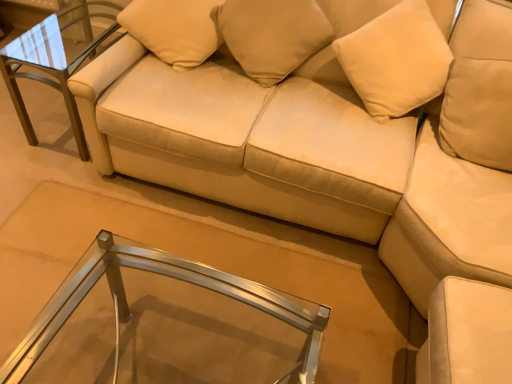
Question: From a real-world perspective, is beige fabric pillow at upper center, the 2th pillow viewed from the left, beneath clear glass table at center, positioned as the second table in top-to-bottom order?

Choices:
 (A) no
 (B) yes

Answer: (A)

Question: From the image's perspective, does beige fabric pillow at upper center, the first pillow positioned from the right, appear higher than clear glass table at center, the first table in the right-to-left sequence?

Choices:
 (A) no
 (B) yes

Answer: (B)

Question: Is beige fabric pillow at upper center, the 2th pillow viewed from the left, shorter than clear glass table at center, the first table in the right-to-left sequence?

Choices:
 (A) yes
 (B) no

Answer: (B)

Question: Is beige fabric pillow at upper center, the 2th pillow viewed from the left, looking in the opposite direction of clear glass table at center, the 1th table in the front-to-back sequence?

Choices:
 (A) no
 (B) yes

Answer: (A)

Question: Considering the relative sizes of beige fabric pillow at upper center, the 2th pillow viewed from the left, and clear glass table at center, the 2th table positioned from the left, in the image provided, is beige fabric pillow at upper center, the 2th pillow viewed from the left, smaller than clear glass table at center, the 2th table positioned from the left,?

Choices:
 (A) yes
 (B) no

Answer: (A)

Question: From a real-world perspective, relative to beige fabric pillow at upper center, which appears as the first pillow when viewed from the left, is clear glass table at center, the 2th table positioned from the left, vertically above or below?

Choices:
 (A) above
 (B) below

Answer: (B)

Question: From the image's perspective, is clear glass table at center, the 2th table positioned from the left, positioned above or below beige fabric pillow at upper center, which appears as the first pillow when viewed from the left?

Choices:
 (A) below
 (B) above

Answer: (A)

Question: Relative to beige fabric pillow at upper center, which appears as the 2th pillow when viewed from the right, is clear glass table at center, the 1th table in the front-to-back sequence, in front or behind?

Choices:
 (A) front
 (B) behind

Answer: (A)

Question: Considering the positions of clear glass table at center, the 2th table positioned from the left, and beige fabric pillow at upper center, which appears as the first pillow when viewed from the left, in the image, is clear glass table at center, the 2th table positioned from the left, bigger or smaller than beige fabric pillow at upper center, which appears as the first pillow when viewed from the left,?

Choices:
 (A) small
 (B) big

Answer: (B)

Question: In terms of height, does beige fabric pillow at upper center, which appears as the 2th pillow when viewed from the right, look taller or shorter compared to metal/glass side table at upper left, the 1th table viewed from the left?

Choices:
 (A) tall
 (B) short

Answer: (B)

Question: From a real-world perspective, relative to metal/glass side table at upper left, which is counted as the first table, starting from the top, is beige fabric pillow at upper center, which appears as the first pillow when viewed from the left, vertically above or below?

Choices:
 (A) above
 (B) below

Answer: (A)

Question: Visually, is beige fabric pillow at upper center, which appears as the first pillow when viewed from the left, positioned to the left or to the right of metal/glass side table at upper left, placed as the 2th table when sorted from right to left?

Choices:
 (A) left
 (B) right

Answer: (B)

Question: Does point (185, 59) appear closer or farther from the camera than point (37, 74)?

Choices:
 (A) closer
 (B) farther

Answer: (A)

Question: Is point (22, 57) closer or farther from the camera than point (119, 309)?

Choices:
 (A) closer
 (B) farther

Answer: (B)

Question: In terms of size, does metal/glass side table at upper left, the 2th table from the bottom, appear bigger or smaller than clear glass table at center, placed as the 1th table when sorted from bottom to top?

Choices:
 (A) big
 (B) small

Answer: (B)